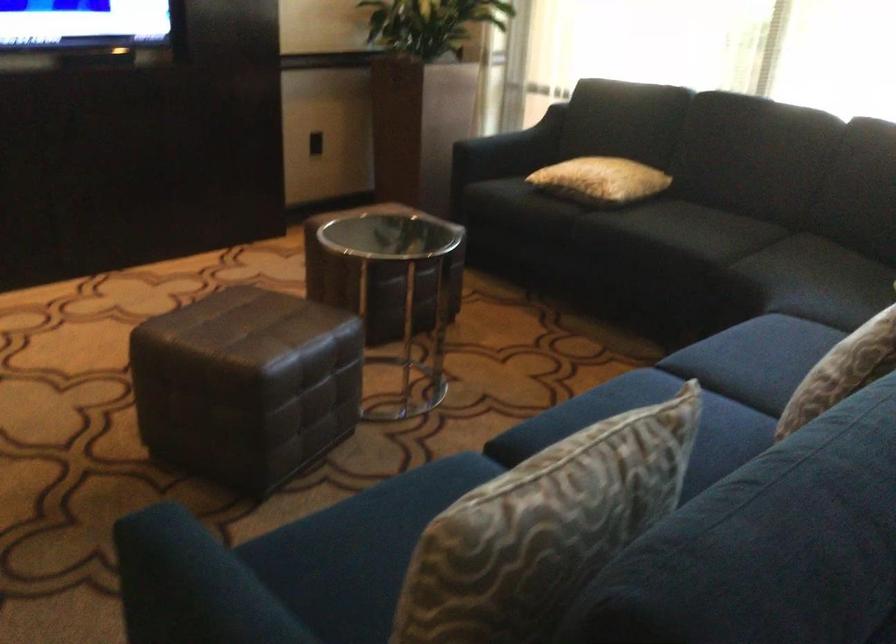
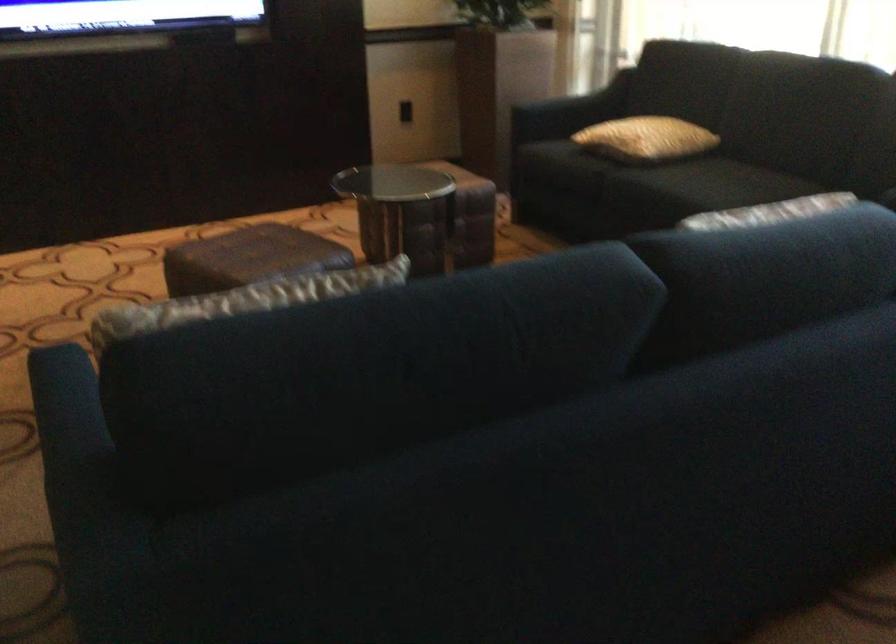
Find the pixel in the second image that matches the point at 609,182 in the first image.

(645, 138)